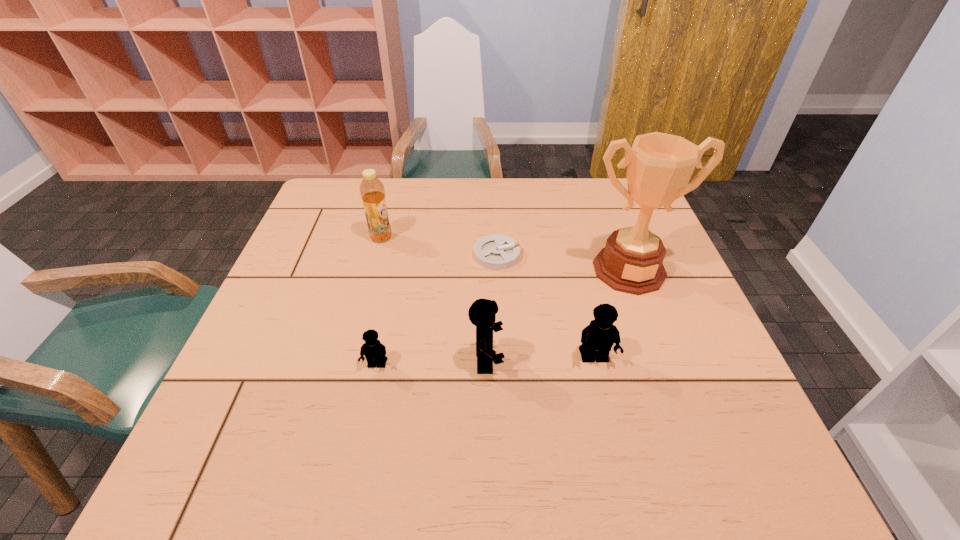
Identify which object is located as the third nearest to the second tallest Lego. Please provide its 2D coordinates. Your answer should be formatted as a tuple, i.e. [(x, y)], where the tuple contains the x and y coordinates of a point satisfying the conditions above.

[(495, 252)]

Locate which Lego ranks second in proximity to the shortest object. Please provide its 2D coordinates. Your answer should be formatted as a tuple, i.e. [(x, y)], where the tuple contains the x and y coordinates of a point satisfying the conditions above.

[(597, 339)]

Locate which Lego is the third closest to the second tallest object. Please provide its 2D coordinates. Your answer should be formatted as a tuple, i.e. [(x, y)], where the tuple contains the x and y coordinates of a point satisfying the conditions above.

[(597, 339)]

I want to click on free spot that satisfies the following two spatial constraints: 1. on the front-facing side of the award; 2. on the front-facing side of the second Lego from right to left, so click(x=662, y=361).

This screenshot has width=960, height=540. I want to click on vacant space that satisfies the following two spatial constraints: 1. on the front-facing side of the second Lego from left to right; 2. on the front-facing side of the shortest Lego, so click(x=487, y=365).